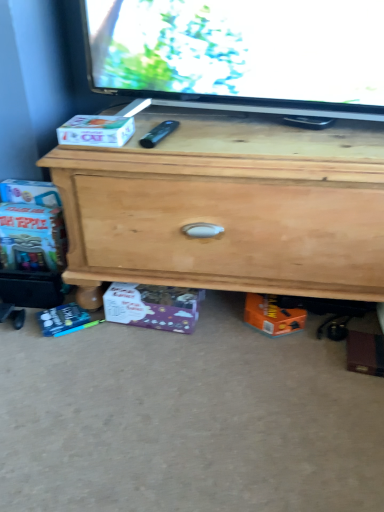
The height and width of the screenshot is (512, 384). I want to click on vacant region to the left of purple cardboard box at lower center, the 2th box from the front, so click(x=84, y=338).